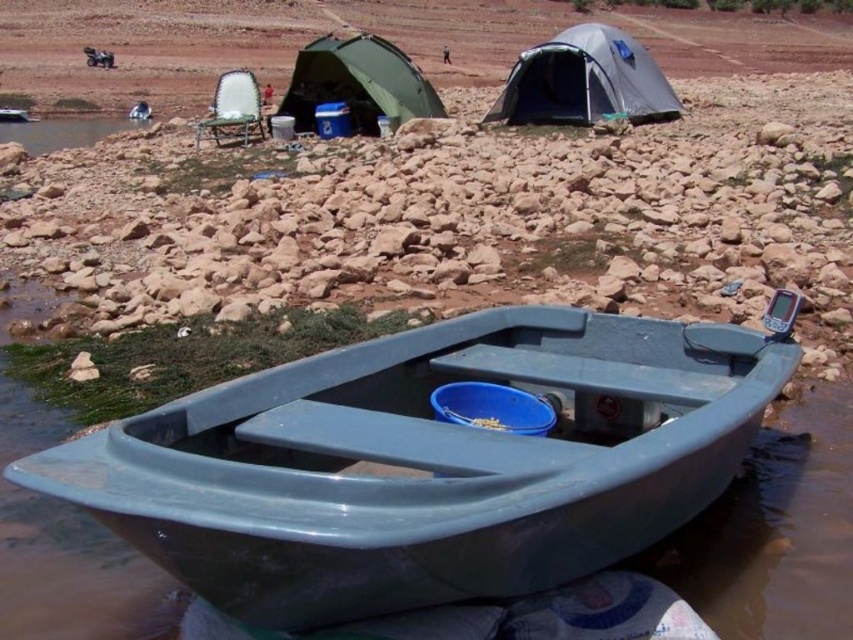
Question: Can you confirm if gray fabric tent at upper center is positioned above green fabric tent at upper center?

Choices:
 (A) no
 (B) yes

Answer: (B)

Question: Which of the following is the farthest from the observer?

Choices:
 (A) (590, 426)
 (B) (492, 109)
 (C) (320, 93)

Answer: (C)

Question: Which of these objects is positioned farthest from the matte plastic boat at lower center?

Choices:
 (A) gray fabric tent at upper center
 (B) green fabric tent at upper center

Answer: (A)

Question: Is matte plastic boat at lower center bigger than green fabric tent at upper center?

Choices:
 (A) yes
 (B) no

Answer: (B)

Question: From the image, what is the correct spatial relationship of matte plastic boat at lower center in relation to green fabric tent at upper center?

Choices:
 (A) left
 (B) right

Answer: (B)

Question: Which point is closer to the camera?

Choices:
 (A) green fabric tent at upper center
 (B) gray fabric tent at upper center

Answer: (A)